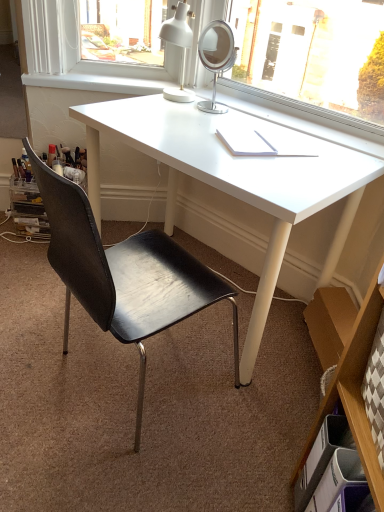
This screenshot has height=512, width=384. I want to click on vacant area that is in front of black leather chair at center, so click(102, 468).